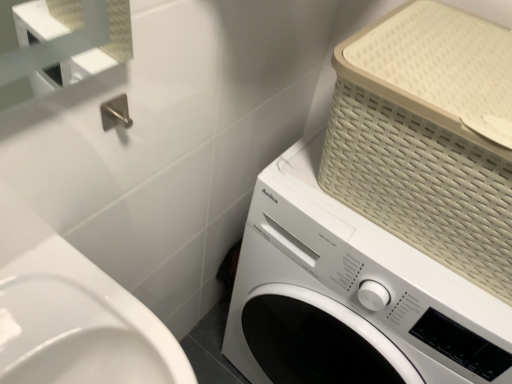
Question: Is white matte washing machine at center beside beige woven basket at upper right?

Choices:
 (A) yes
 (B) no

Answer: (B)

Question: Considering the relative positions of white matte washing machine at center and beige woven basket at upper right in the image provided, is white matte washing machine at center to the left of beige woven basket at upper right from the viewer's perspective?

Choices:
 (A) no
 (B) yes

Answer: (B)

Question: Does white matte washing machine at center come in front of beige woven basket at upper right?

Choices:
 (A) no
 (B) yes

Answer: (A)

Question: Can you confirm if white matte washing machine at center is taller than beige woven basket at upper right?

Choices:
 (A) yes
 (B) no

Answer: (A)

Question: Does white matte washing machine at center have a lesser height compared to beige woven basket at upper right?

Choices:
 (A) no
 (B) yes

Answer: (A)

Question: Is white matte washing machine at center at the right side of beige woven basket at upper right?

Choices:
 (A) no
 (B) yes

Answer: (A)

Question: Can you see beige woven basket at upper right touching white matte washing machine at center?

Choices:
 (A) no
 (B) yes

Answer: (A)

Question: Is beige woven basket at upper right aimed at white matte washing machine at center?

Choices:
 (A) yes
 (B) no

Answer: (B)

Question: Is beige woven basket at upper right outside of white matte washing machine at center?

Choices:
 (A) no
 (B) yes

Answer: (B)

Question: From the image's perspective, is beige woven basket at upper right beneath white matte washing machine at center?

Choices:
 (A) yes
 (B) no

Answer: (B)

Question: Is white matte washing machine at center completely or partially inside beige woven basket at upper right?

Choices:
 (A) yes
 (B) no

Answer: (B)

Question: Considering the relative sizes of beige woven basket at upper right and white matte washing machine at center in the image provided, is beige woven basket at upper right thinner than white matte washing machine at center?

Choices:
 (A) yes
 (B) no

Answer: (A)

Question: In terms of height, does beige woven basket at upper right look taller or shorter compared to white matte washing machine at center?

Choices:
 (A) tall
 (B) short

Answer: (B)